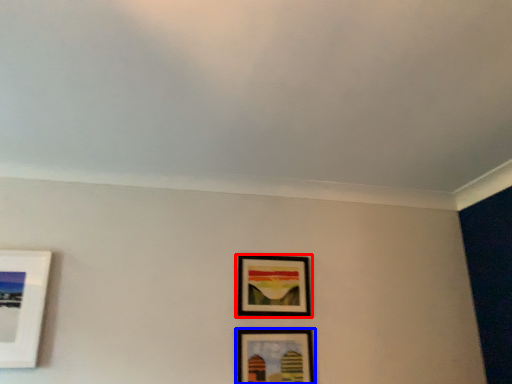
Question: Which object appears closest to the camera in this image, picture frame (highlighted by a red box) or picture frame (highlighted by a blue box)?

Choices:
 (A) picture frame
 (B) picture frame

Answer: (B)